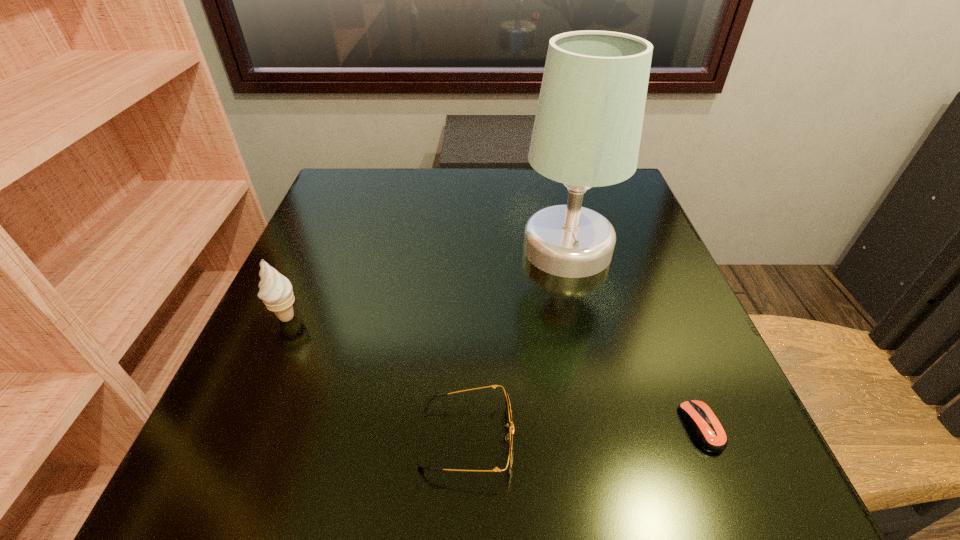
Identify the location of free space located on the base of the tallest object. coord(428,248).

This screenshot has width=960, height=540. In order to click on free space located 0.140m on the front-facing side of the second farthest object in this screenshot , I will do `click(252, 398)`.

In order to click on free location located 0.140m on the front-facing side of the second shortest object in this screenshot , I will do `click(612, 439)`.

The image size is (960, 540). Find the location of `free space located on the left of the computer mouse`. free space located on the left of the computer mouse is located at coordinates (518, 427).

The width and height of the screenshot is (960, 540). I want to click on sunglasses that is at the near edge, so click(510, 440).

Identify the location of computer mouse located in the near edge section of the desktop. (707, 430).

Where is `object located in the left edge section of the desktop`? This screenshot has height=540, width=960. object located in the left edge section of the desktop is located at coordinates (276, 292).

Identify the location of lampshade that is at the right edge. (587, 130).

Where is `computer mouse that is at the right edge`? computer mouse that is at the right edge is located at coordinates (707, 430).

Where is `object that is at the near right corner`? object that is at the near right corner is located at coordinates (707, 430).